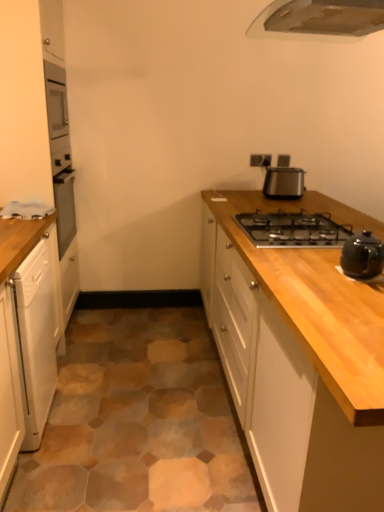
The image size is (384, 512). What are the coordinates of `wooden cabinet at center, the 3th cabinetry from the left` in the screenshot? It's located at (301, 359).

In order to face black metallic gas stove at upper right, should I rotate leftwards or rightwards?

To face it directly, rotate right by 13.624 degrees.

Based on the photo, what is the approximate height of black metallic gas stove at upper right?

The height of black metallic gas stove at upper right is 2.91 inches.

This screenshot has width=384, height=512. What do you see at coordinates (27, 96) in the screenshot? I see `white glossy dishwasher at left, the 3th cabinetry viewed from the right` at bounding box center [27, 96].

This screenshot has width=384, height=512. Describe the element at coordinates (362, 256) in the screenshot. I see `black ceramic teapot at right, which is the 2th kitchen appliance from top to bottom` at that location.

Identify the location of metallic stainless steel toaster at upper right, marked as the first kitchen appliance in a back-to-front arrangement. Image resolution: width=384 pixels, height=512 pixels. (283, 180).

The width and height of the screenshot is (384, 512). In order to click on wooden cabinet at center, positioned as the first cabinetry in right-to-left order in this screenshot , I will do [301, 359].

In the scene shown: From a real-world perspective, does wooden cabinet at center, positioned as the first cabinetry in right-to-left order, sit lower than white glossy dishwasher at left, the 2th cabinetry in the left-to-right sequence?

No, from a real-world perspective, wooden cabinet at center, positioned as the first cabinetry in right-to-left order, is not beneath white glossy dishwasher at left, the 2th cabinetry in the left-to-right sequence.

Is point (303, 415) less distant than point (8, 438)?

Yes, point (303, 415) is in front of point (8, 438).

From the image's perspective, is wooden cabinet at center, positioned as the first cabinetry in right-to-left order, above or below white glossy dishwasher at left, the 2th cabinetry in the left-to-right sequence?

wooden cabinet at center, positioned as the first cabinetry in right-to-left order, is above white glossy dishwasher at left, the 2th cabinetry in the left-to-right sequence.

Which is more to the right, wooden cabinet at center, positioned as the first cabinetry in right-to-left order, or white glossy dishwasher at left, which ranks as the 2th cabinetry in right-to-left order?

wooden cabinet at center, positioned as the first cabinetry in right-to-left order, is more to the right.

Is point (5, 309) positioned in front of point (4, 412)?

Yes, point (5, 309) is closer to viewer.

Can you confirm if white glossy dishwasher at left, the 3th cabinetry viewed from the right, is taller than white glossy dishwasher at left, which ranks as the 2th cabinetry in right-to-left order?

Yes, white glossy dishwasher at left, the 3th cabinetry viewed from the right, is taller than white glossy dishwasher at left, which ranks as the 2th cabinetry in right-to-left order.

Is white glossy dishwasher at left, the 3th cabinetry viewed from the right, thinner than white glossy dishwasher at left, which ranks as the 2th cabinetry in right-to-left order?

In fact, white glossy dishwasher at left, the 3th cabinetry viewed from the right, might be wider than white glossy dishwasher at left, which ranks as the 2th cabinetry in right-to-left order.

From a real-world perspective, is white glossy dishwasher at left, marked as the first cabinetry in a left-to-right arrangement, over white glossy dishwasher at left, which ranks as the 2th cabinetry in right-to-left order?

Yes.

Is black ceramic teapot at right, which is the 2th kitchen appliance from top to bottom, bigger than black metallic gas stove at upper right?

Actually, black ceramic teapot at right, which is the 2th kitchen appliance from top to bottom, might be smaller than black metallic gas stove at upper right.

Does point (350, 246) appear closer or farther from the camera than point (285, 244)?

Point (350, 246) is closer to the camera than point (285, 244).

Can you confirm if black ceramic teapot at right, which is the 2th kitchen appliance from top to bottom, is taller than black metallic gas stove at upper right?

Correct, black ceramic teapot at right, which is the 2th kitchen appliance from top to bottom, is much taller as black metallic gas stove at upper right.

Does black ceramic teapot at right, the second kitchen appliance from the back, come in front of black metallic gas stove at upper right?

Yes, black ceramic teapot at right, the second kitchen appliance from the back, is closer to the camera.

Is metallic silver outlet at upper right thinner than white glossy dishwasher at left, marked as the first cabinetry in a left-to-right arrangement?

Correct, the width of metallic silver outlet at upper right is less than that of white glossy dishwasher at left, marked as the first cabinetry in a left-to-right arrangement.

Is metallic silver outlet at upper right aimed at white glossy dishwasher at left, the 3th cabinetry viewed from the right?

No, metallic silver outlet at upper right is not aimed at white glossy dishwasher at left, the 3th cabinetry viewed from the right.

Which is in front, point (250, 158) or point (45, 136)?

The point (45, 136) is in front.

Considering the relative sizes of white glossy dishwasher at left, which ranks as the 2th cabinetry in right-to-left order, and metallic silver outlet at upper right in the image provided, is white glossy dishwasher at left, which ranks as the 2th cabinetry in right-to-left order, shorter than metallic silver outlet at upper right?

Incorrect, the height of white glossy dishwasher at left, which ranks as the 2th cabinetry in right-to-left order, does not fall short of that of metallic silver outlet at upper right.

Is white glossy dishwasher at left, the 2th cabinetry in the left-to-right sequence, in front of metallic silver outlet at upper right?

Yes, white glossy dishwasher at left, the 2th cabinetry in the left-to-right sequence, is in front of metallic silver outlet at upper right.

From a real-world perspective, between white glossy dishwasher at left, the 2th cabinetry in the left-to-right sequence, and metallic silver outlet at upper right, who is vertically higher?

From a 3D spatial view, metallic silver outlet at upper right is above.

Which is closer, (13,431) or (259,156)?

Point (13,431).

From the picture: Between white glossy dishwasher at left, which ranks as the 2th cabinetry in right-to-left order, and black ceramic teapot at right, the second kitchen appliance from the back, which one appears on the right side from the viewer's perspective?

Positioned to the right is black ceramic teapot at right, the second kitchen appliance from the back.

Between point (3, 312) and point (357, 248), which one is positioned behind?

The point (3, 312) is farther from the camera.

Who is more distant, white glossy dishwasher at left, marked as the first cabinetry in a left-to-right arrangement, or metallic stainless steel toaster at upper right, which is counted as the 2th kitchen appliance, starting from the front?

Positioned behind is metallic stainless steel toaster at upper right, which is counted as the 2th kitchen appliance, starting from the front.

Which point is more distant from viewer, [30,8] or [287,192]?

Point [287,192]

Find the location of a particular element. The height and width of the screenshot is (512, 384). cabinetry that is the 1st one when counting backward from the wooden cabinet at center, the 3th cabinetry from the left is located at coordinates (13, 340).

From the image's perspective, which cabinetry is the 2nd one above the white glossy dishwasher at left, which ranks as the 2th cabinetry in right-to-left order? Please provide its 2D coordinates.

[(27, 96)]

Consider the image. Which object lies nearer to the anchor point white glossy dishwasher at left, marked as the first cabinetry in a left-to-right arrangement, wooden cabinet at center, positioned as the first cabinetry in right-to-left order, or black ceramic teapot at right, which is the 2th kitchen appliance from top to bottom?

wooden cabinet at center, positioned as the first cabinetry in right-to-left order.

Based on their spatial positions, is white glossy dishwasher at left, marked as the first cabinetry in a left-to-right arrangement, or black ceramic teapot at right, which appears as the first kitchen appliance when viewed from the front, further from wooden cabinet at center, the 3th cabinetry from the left?

Among the two, white glossy dishwasher at left, marked as the first cabinetry in a left-to-right arrangement, is located further to wooden cabinet at center, the 3th cabinetry from the left.

When comparing their distances from wooden cabinet at center, positioned as the first cabinetry in right-to-left order, does black ceramic teapot at right, which appears as the first kitchen appliance when viewed from the front, or white glossy dishwasher at left, marked as the first cabinetry in a left-to-right arrangement, seem closer?

black ceramic teapot at right, which appears as the first kitchen appliance when viewed from the front, lies closer to wooden cabinet at center, positioned as the first cabinetry in right-to-left order, than the other object.

Which object lies nearer to the anchor point white glossy dishwasher at left, the 2th cabinetry in the left-to-right sequence, wooden cabinet at center, positioned as the first cabinetry in right-to-left order, or white glossy dishwasher at left, marked as the first cabinetry in a left-to-right arrangement?

The object closer to white glossy dishwasher at left, the 2th cabinetry in the left-to-right sequence, is white glossy dishwasher at left, marked as the first cabinetry in a left-to-right arrangement.

Which object lies further to the anchor point white glossy dishwasher at left, the 3th cabinetry viewed from the right, black ceramic teapot at right, which appears as the first kitchen appliance when viewed from the front, or black metallic gas stove at upper right?

The object further to white glossy dishwasher at left, the 3th cabinetry viewed from the right, is black ceramic teapot at right, which appears as the first kitchen appliance when viewed from the front.

From the image, which object appears to be farther from black ceramic teapot at right, the 1th kitchen appliance from the bottom, black metallic gas stove at upper right or metallic stainless steel toaster at upper right, which is counted as the 2th kitchen appliance, starting from the front?

Based on the image, metallic stainless steel toaster at upper right, which is counted as the 2th kitchen appliance, starting from the front, appears to be further to black ceramic teapot at right, the 1th kitchen appliance from the bottom.

Consider the image. Which object lies further to the anchor point black ceramic teapot at right, which appears as the first kitchen appliance when viewed from the front, white glossy dishwasher at left, which ranks as the 2th cabinetry in right-to-left order, or black metallic gas stove at upper right?

white glossy dishwasher at left, which ranks as the 2th cabinetry in right-to-left order, lies further to black ceramic teapot at right, which appears as the first kitchen appliance when viewed from the front, than the other object.

From the image, which object appears to be nearer to metallic stainless steel toaster at upper right, marked as the first kitchen appliance in a back-to-front arrangement, white glossy dishwasher at left, marked as the first cabinetry in a left-to-right arrangement, or metallic silver outlet at upper right?

metallic silver outlet at upper right is positioned closer to the anchor metallic stainless steel toaster at upper right, marked as the first kitchen appliance in a back-to-front arrangement.

This screenshot has width=384, height=512. I want to click on gas stove positioned between wooden cabinet at center, positioned as the first cabinetry in right-to-left order, and metallic stainless steel toaster at upper right, which is counted as the 2th kitchen appliance, starting from the front, from near to far, so click(x=293, y=230).

Image resolution: width=384 pixels, height=512 pixels. I want to click on gas stove between white glossy dishwasher at left, which ranks as the 2th cabinetry in right-to-left order, and wooden cabinet at center, the 3th cabinetry from the left, from left to right, so click(x=293, y=230).

The image size is (384, 512). In order to click on electric outlet between white glossy dishwasher at left, the 3th cabinetry viewed from the right, and metallic stainless steel toaster at upper right, the 2th kitchen appliance from the bottom in this screenshot , I will do `click(260, 160)`.

Find the location of a particular element. This screenshot has height=512, width=384. kitchen appliance between wooden cabinet at center, the 3th cabinetry from the left, and black metallic gas stove at upper right, along the z-axis is located at coordinates (362, 256).